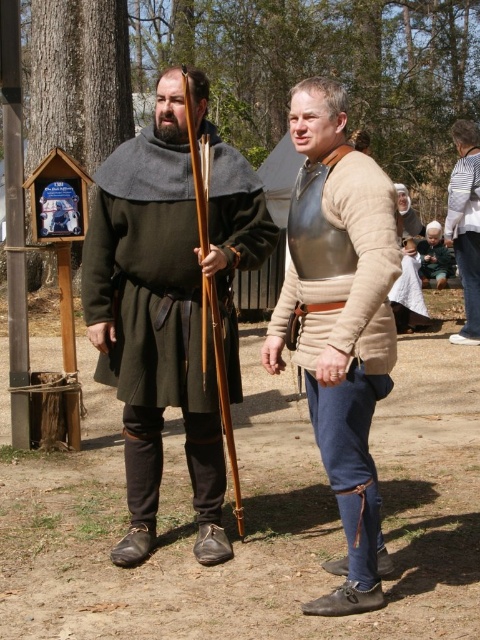
Is point (462, 204) closer to camera compared to point (442, 250)?

Yes, point (462, 204) is in front of point (442, 250).

Is point (478, 276) farther from viewer compared to point (433, 264)?

No, it is in front of (433, 264).

This screenshot has width=480, height=640. Identify the location of striped cotton sweater at upper right. (466, 236).

Between point (350, 448) and point (447, 272), which one is positioned in front?

Point (350, 448)

Can you confirm if metallic armor at center is bigger than green woolen cloak at center?

No, metallic armor at center is not bigger than green woolen cloak at center.

What do you see at coordinates (339, 323) in the screenshot? I see `metallic armor at center` at bounding box center [339, 323].

This screenshot has width=480, height=640. Identify the location of metallic armor at center. (339, 323).

Who is more forward, (163, 170) or (432, 230)?

Point (163, 170) is more forward.

Which is more to the left, green woolen tunic at center or green woolen cloak at center?

green woolen tunic at center is more to the left.

Find the location of a particular element. Image resolution: width=480 pixels, height=640 pixels. green woolen tunic at center is located at coordinates (168, 304).

Identify the location of green woolen tunic at center. The image size is (480, 640). (168, 304).